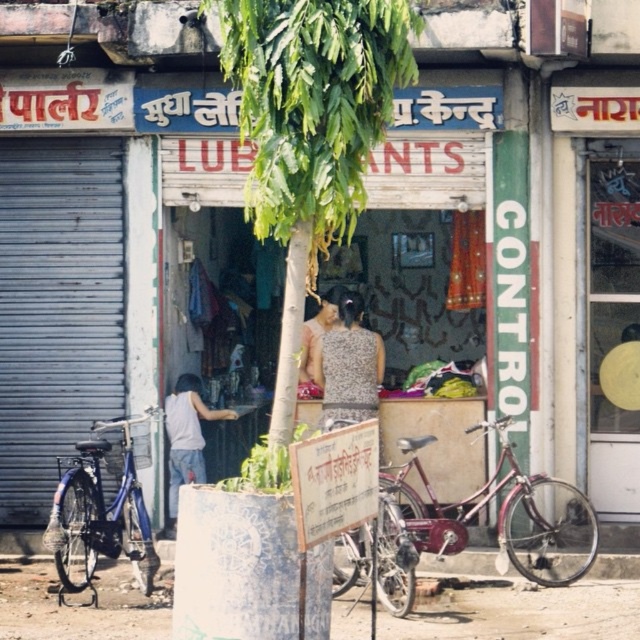
Question: Does speckled fabric dress at center have a greater width compared to shiny metallic bicycle at center?

Choices:
 (A) yes
 (B) no

Answer: (B)

Question: Which object is farther from the camera taking this photo?

Choices:
 (A) green leafy tree at center
 (B) shiny metallic bicycle at center
 (C) speckled fabric dress at center

Answer: (C)

Question: Does maroon metallic bicycle at lower right appear on the right side of blue metallic bicycle at left?

Choices:
 (A) no
 (B) yes

Answer: (B)

Question: Can you confirm if blue metallic bicycle at left is thinner than shiny metallic bicycle at center?

Choices:
 (A) yes
 (B) no

Answer: (B)

Question: Estimate the real-world distances between objects in this image. Which object is farther from the green leafy tree at center?

Choices:
 (A) blue metallic bicycle at left
 (B) speckled fabric dress at center

Answer: (B)

Question: Estimate the real-world distances between objects in this image. Which object is closer to the maroon metallic bicycle at lower right?

Choices:
 (A) green leafy tree at center
 (B) speckled fabric dress at center
 (C) blue metallic bicycle at left

Answer: (B)